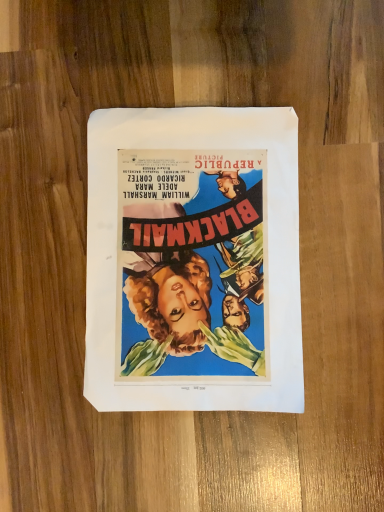
Find the location of a particular element. vibrant paper poster at center is located at coordinates (193, 260).

This screenshot has height=512, width=384. What do you see at coordinates (193, 260) in the screenshot?
I see `vibrant paper poster at center` at bounding box center [193, 260].

Where is `vibrant paper poster at center`? This screenshot has width=384, height=512. vibrant paper poster at center is located at coordinates (193, 260).